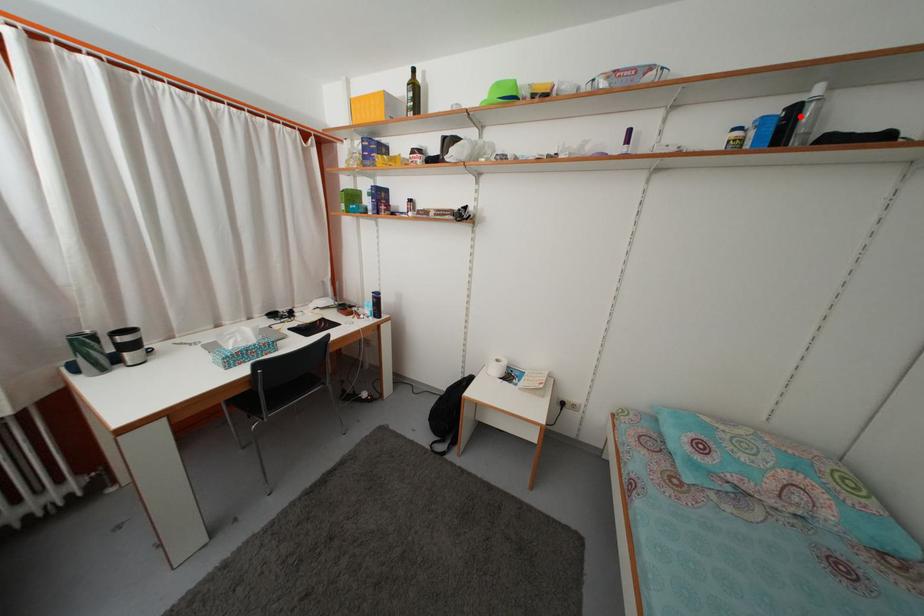
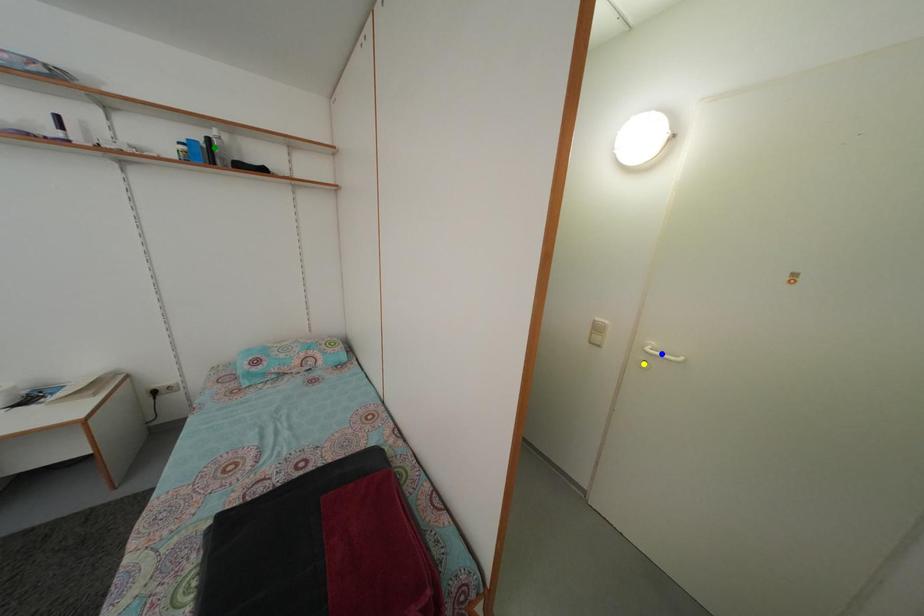
Question: I am providing you with two images of the same scene from different viewpoints. A red point is marked on the first image. You are given multiple points on the second image. Which spot in image 2 lines up with the point in image 1?

Choices:
 (A) green point
 (B) yellow point
 (C) blue point

Answer: (A)